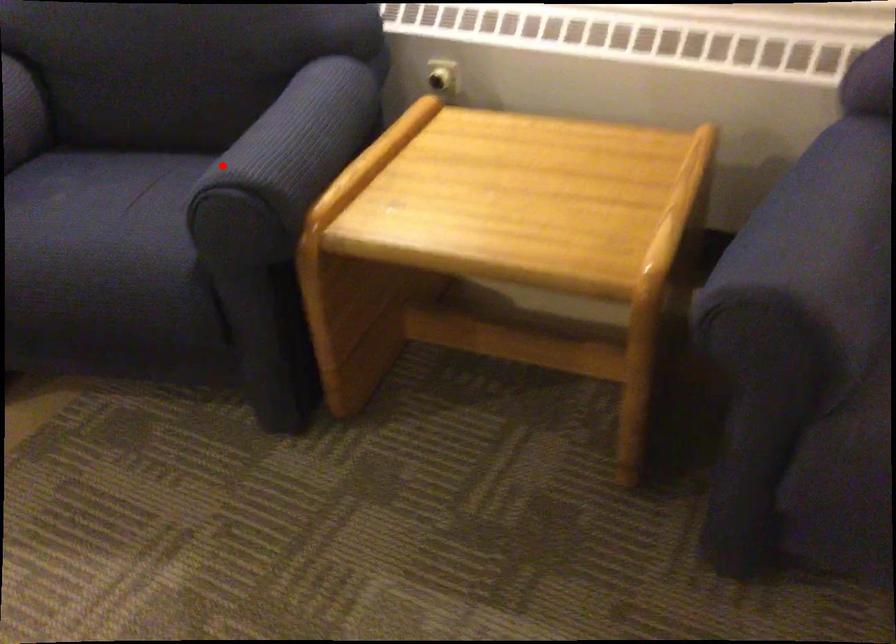
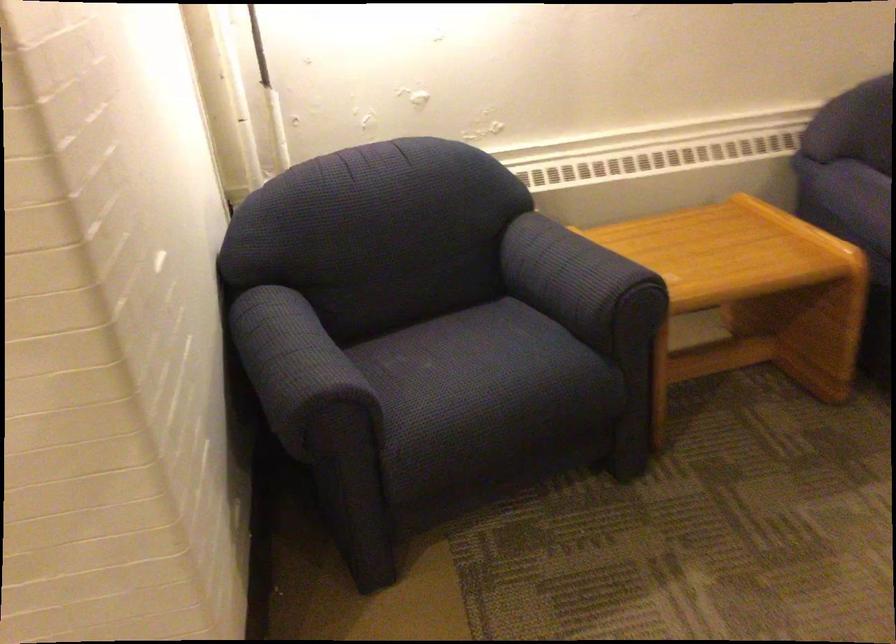
The point at the highlighted location is marked in the first image. Where is the corresponding point in the second image?

(579, 281)